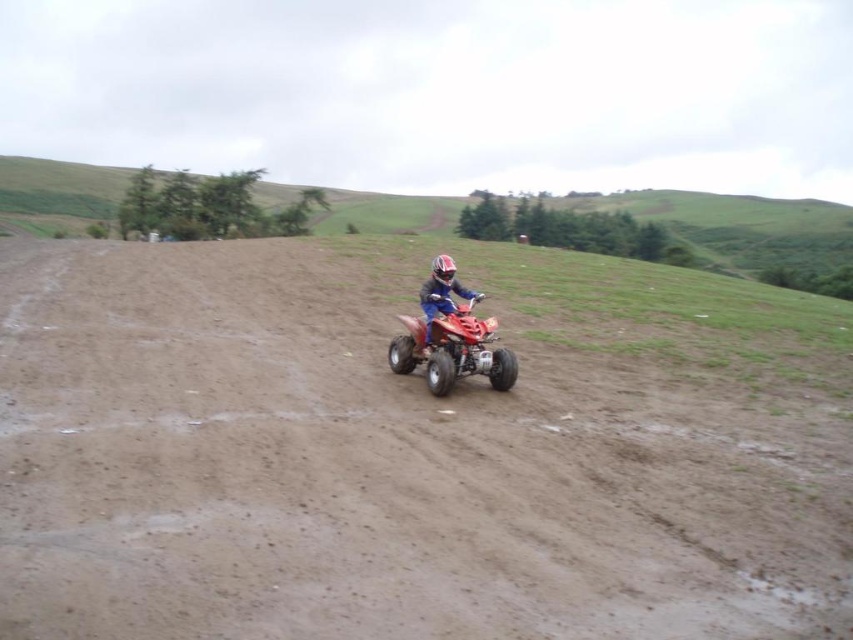
Who is shorter, brown sandy terrain at center or shiny red quad bike at center?

Standing shorter between the two is shiny red quad bike at center.

Measure the distance between point (x=79, y=584) and camera.

14.19 feet

Where is `brown sandy terrain at center`? This screenshot has width=853, height=640. brown sandy terrain at center is located at coordinates (415, 449).

Which is more to the right, shiny red quad bike at center or matte orange quad bike at center?

Positioned to the right is matte orange quad bike at center.

Is point (450, 296) closer to camera compared to point (438, 257)?

Yes, it is.

The height and width of the screenshot is (640, 853). I want to click on shiny red quad bike at center, so click(450, 337).

Which is above, brown sandy terrain at center or matte orange quad bike at center?

matte orange quad bike at center is higher up.

Between brown sandy terrain at center and matte orange quad bike at center, which one is positioned lower?

brown sandy terrain at center

Locate an element on the screen. This screenshot has width=853, height=640. brown sandy terrain at center is located at coordinates (415, 449).